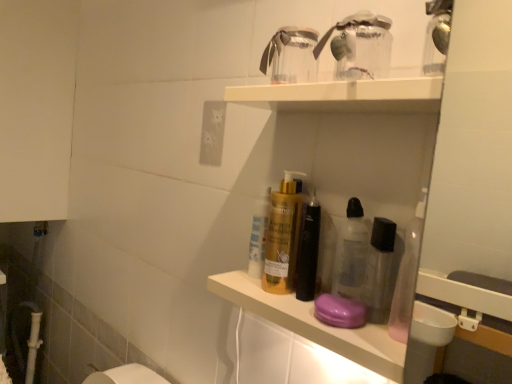
Question: Is white matte electric outlet at upper center directly adjacent to transparent plastic shelf at upper center?

Choices:
 (A) no
 (B) yes

Answer: (A)

Question: Does white matte electric outlet at upper center have a lesser width compared to transparent plastic shelf at upper center?

Choices:
 (A) yes
 (B) no

Answer: (A)

Question: Is white matte electric outlet at upper center oriented towards transparent plastic shelf at upper center?

Choices:
 (A) no
 (B) yes

Answer: (A)

Question: Is white matte electric outlet at upper center wider than transparent plastic shelf at upper center?

Choices:
 (A) no
 (B) yes

Answer: (A)

Question: Is white matte electric outlet at upper center outside transparent plastic shelf at upper center?

Choices:
 (A) no
 (B) yes

Answer: (B)

Question: Does white matte electric outlet at upper center lie behind transparent plastic shelf at upper center?

Choices:
 (A) no
 (B) yes

Answer: (B)

Question: Is transparent plastic shelf at upper center smaller than white matte electric outlet at upper center?

Choices:
 (A) yes
 (B) no

Answer: (B)

Question: Is transparent plastic shelf at upper center surrounding white matte electric outlet at upper center?

Choices:
 (A) yes
 (B) no

Answer: (B)

Question: Is transparent plastic shelf at upper center further to the viewer compared to white matte electric outlet at upper center?

Choices:
 (A) yes
 (B) no

Answer: (B)

Question: Does transparent plastic shelf at upper center have a lesser height compared to white matte electric outlet at upper center?

Choices:
 (A) yes
 (B) no

Answer: (B)

Question: From the image's perspective, does transparent plastic shelf at upper center appear lower than white matte electric outlet at upper center?

Choices:
 (A) no
 (B) yes

Answer: (B)

Question: Can you confirm if transparent plastic shelf at upper center is positioned to the right of white matte electric outlet at upper center?

Choices:
 (A) no
 (B) yes

Answer: (B)

Question: From the image's perspective, relative to white matte electric outlet at upper center, is transparent plastic shelf at upper center above or below?

Choices:
 (A) below
 (B) above

Answer: (A)